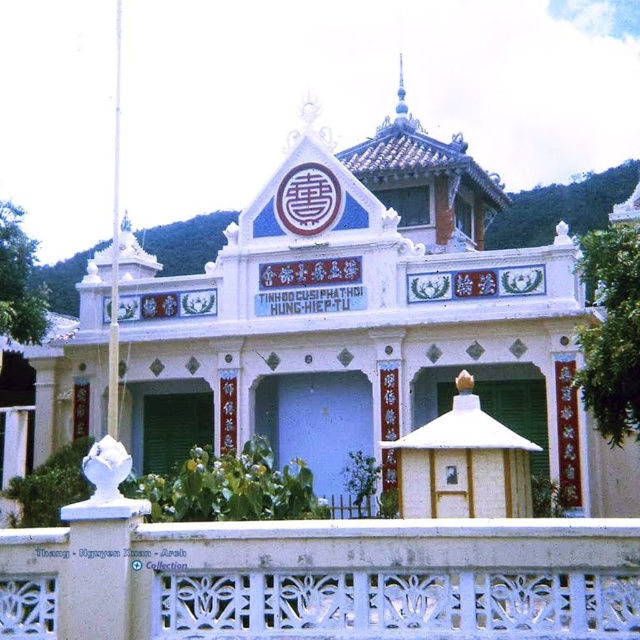
Between white painted wood palace at center and white carved stone balustrade at lower center, which one appears on the right side from the viewer's perspective?

From the viewer's perspective, white carved stone balustrade at lower center appears more on the right side.

Does white painted wood palace at center have a greater height compared to white carved stone balustrade at lower center?

Yes, white painted wood palace at center is taller than white carved stone balustrade at lower center.

Is point (212, 320) positioned before point (104, 552)?

No, it is behind (104, 552).

Find the location of a particular element. white painted wood palace at center is located at coordinates (362, 321).